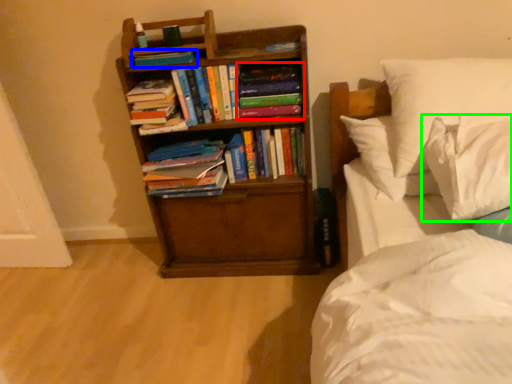
Question: Which is nearer to the book (highlighted by a red box)? book (highlighted by a blue box) or pillow (highlighted by a green box).

Choices:
 (A) book
 (B) pillow

Answer: (A)